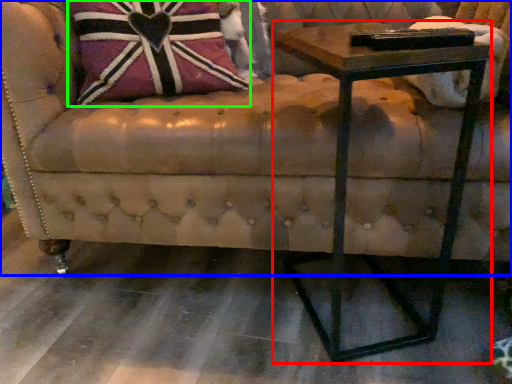
Question: Estimate the real-world distances between objects in this image. Which object is farther from table (highlighted by a red box), studio couch (highlighted by a blue box) or throw pillow (highlighted by a green box)?

Choices:
 (A) studio couch
 (B) throw pillow

Answer: (B)